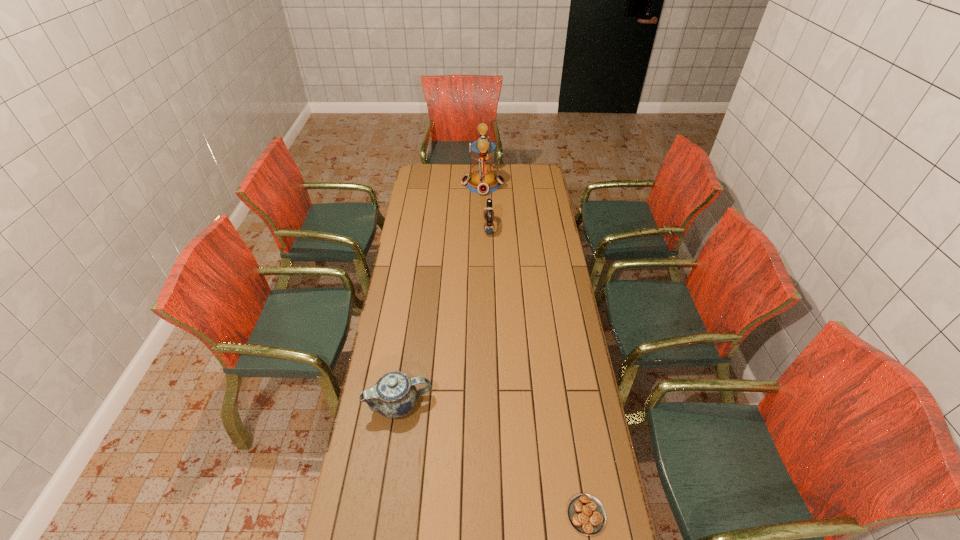
In the image, there is a desktop. Identify the location of free region at the right edge. (553, 228).

Locate an element on the screen. The width and height of the screenshot is (960, 540). free space between the tallest object and the headset is located at coordinates (486, 206).

Find the location of `unoccupied position between the third farthest object and the shortest object`. unoccupied position between the third farthest object and the shortest object is located at coordinates (492, 460).

The image size is (960, 540). What are the coordinates of `vacant space in between the headset and the chinaware` in the screenshot? It's located at (444, 316).

This screenshot has width=960, height=540. In order to click on empty location between the second farthest object and the lantern in this screenshot , I will do `click(486, 206)`.

Locate an element on the screen. The height and width of the screenshot is (540, 960). vacant area that lies between the tallest object and the second farthest object is located at coordinates (486, 206).

This screenshot has width=960, height=540. Identify the location of vacant area between the third nearest object and the nearest object. (538, 371).

In order to click on empty location between the leftmost object and the tallest object in this screenshot , I will do `click(441, 294)`.

Where is `free space that is in between the third nearest object and the pastry`? This screenshot has height=540, width=960. free space that is in between the third nearest object and the pastry is located at coordinates (538, 371).

Where is `vacant space that is in between the headset and the pastry`? vacant space that is in between the headset and the pastry is located at coordinates (538, 371).